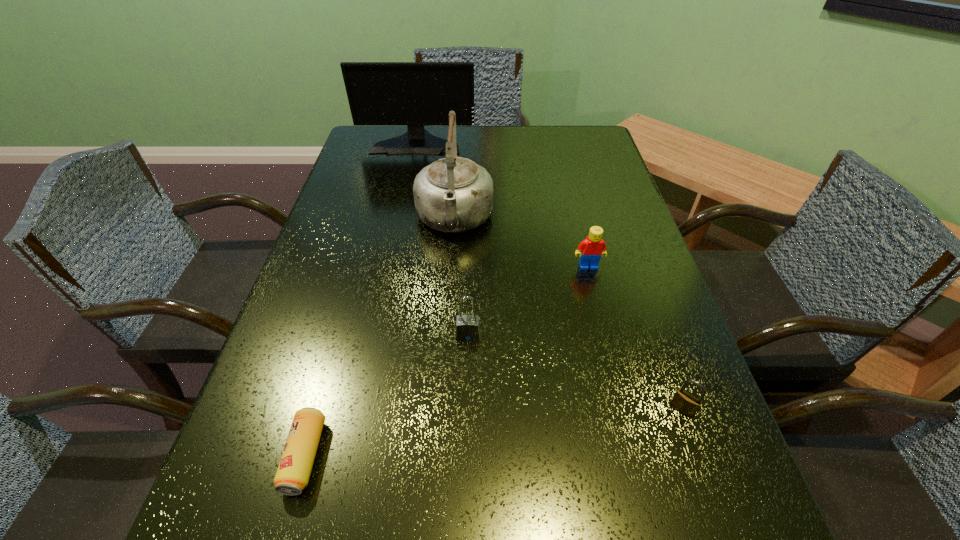
What are the coordinates of `vacant space situated on the screen side of the farthest object` in the screenshot? It's located at (402, 213).

Find the location of `vacant point located 0.100m at the spout of the second farthest object`. vacant point located 0.100m at the spout of the second farthest object is located at coordinates (450, 282).

The height and width of the screenshot is (540, 960). In order to click on vacant space located 0.320m on the face of the fourth nearest object in this screenshot , I will do `click(622, 400)`.

The width and height of the screenshot is (960, 540). I want to click on vacant area situated on the shackle of the fourth farthest object, so click(465, 480).

Locate an element on the screen. Image resolution: width=960 pixels, height=540 pixels. vacant region located 0.060m on the back of the fifth tallest object is located at coordinates (668, 370).

At what (x,y) coordinates should I click in order to perform the action: click on vacant space located on the back of the nearest object. Please return your answer as a coordinate pair (x, y). The height and width of the screenshot is (540, 960). Looking at the image, I should click on (359, 264).

Locate an element on the screen. The height and width of the screenshot is (540, 960). object that is at the far edge is located at coordinates (415, 94).

Locate an element on the screen. monitor situated at the left edge is located at coordinates (415, 94).

The width and height of the screenshot is (960, 540). What are the coordinates of `beer can situated at the left edge` in the screenshot? It's located at (293, 473).

Where is `Lego at the right edge`? This screenshot has width=960, height=540. Lego at the right edge is located at coordinates (590, 250).